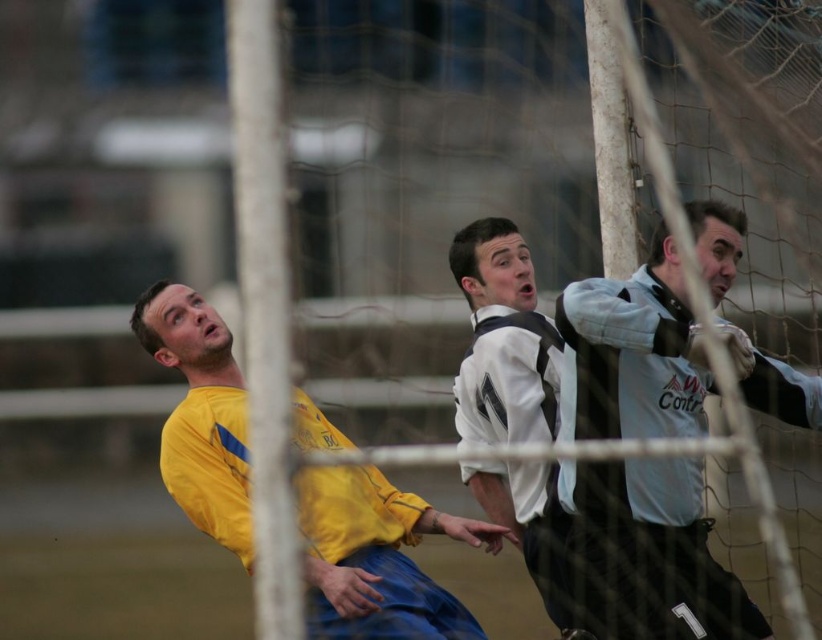
Question: Among these objects, which one is farthest from the camera?

Choices:
 (A) white matte jersey at center
 (B) white mesh net at center

Answer: (A)

Question: Can you confirm if white mesh net at center is bigger than white jersey at center?

Choices:
 (A) no
 (B) yes

Answer: (B)

Question: Which object appears farthest from the camera in this image?

Choices:
 (A) yellow jersey at left
 (B) white jersey at center
 (C) white matte jersey at center

Answer: (A)

Question: Is white mesh net at center below yellow jersey at left?

Choices:
 (A) no
 (B) yes

Answer: (A)

Question: Estimate the real-world distances between objects in this image. Which object is farther from the white matte jersey at center?

Choices:
 (A) yellow jersey at left
 (B) white jersey at center
 (C) white mesh net at center

Answer: (C)

Question: Is white mesh net at center below yellow jersey at left?

Choices:
 (A) no
 (B) yes

Answer: (A)